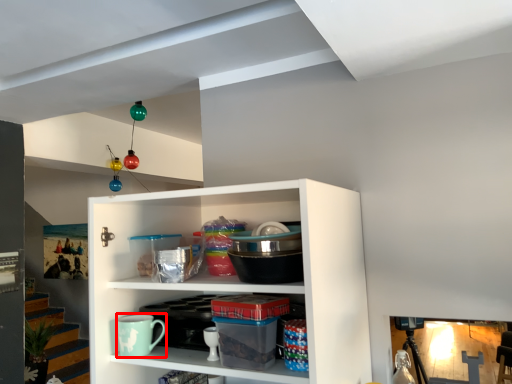
Question: From the image, what is the correct spatial relationship of mug (annotated by the red box) in relation to cabinet?

Choices:
 (A) left
 (B) right

Answer: (A)